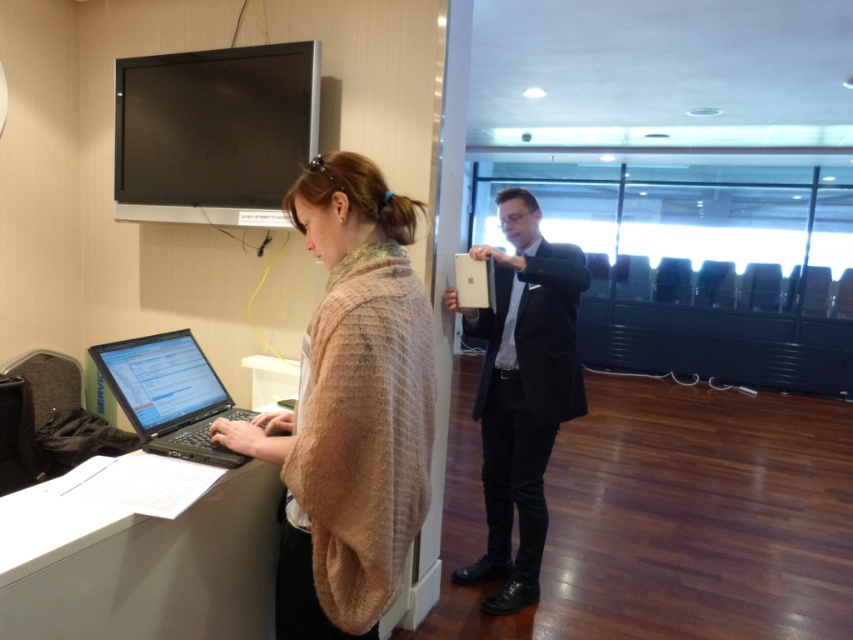
Question: Can you confirm if beige knitted shawl at center is wider than matte black suit at center?

Choices:
 (A) yes
 (B) no

Answer: (B)

Question: Can you confirm if matte black suit at center is wider than black matte laptop at left?

Choices:
 (A) no
 (B) yes

Answer: (B)

Question: Which of the following is the closest to the observer?

Choices:
 (A) (538, 326)
 (B) (126, 396)

Answer: (B)

Question: Which object is closer to the camera taking this photo?

Choices:
 (A) black matte laptop at left
 (B) matte black suit at center
 (C) beige knitted shawl at center

Answer: (C)

Question: Which of these objects is positioned farthest from the black matte laptop at left?

Choices:
 (A) matte black suit at center
 (B) beige knitted shawl at center

Answer: (A)

Question: Where is beige knitted shawl at center located in relation to black matte laptop at left in the image?

Choices:
 (A) left
 (B) right

Answer: (B)